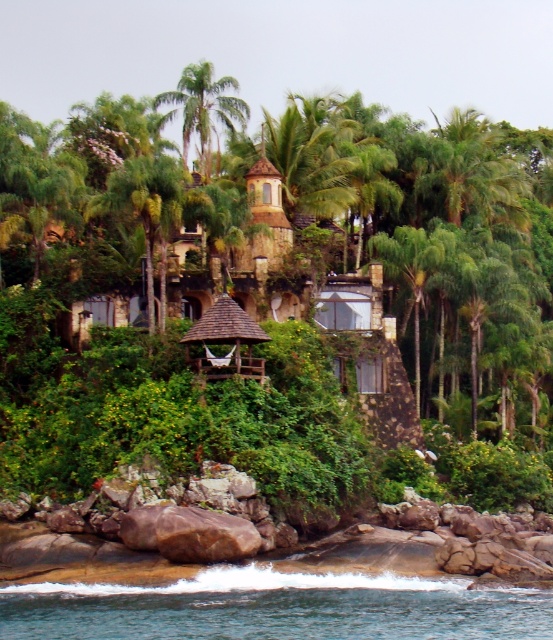
You are standing on the rocky shoreline and want to reach the rustic wood hut at center without getting your feet wet. Which direction should you walk from the clear blue water at lower center?

You should walk to the left from the clear blue water at lower center because it is to the right of the rustic wood hut at center, so moving left will take you towards the hut.

You are standing at the point marked as point [368,353] in the coastal scene. What structure can you see directly in front of you?

At point [368,353] lies rustic wood hut at center, so you can see the rustic wood hut at center directly in front of you.

You are planning to build a small garden between the clear blue water at lower center and the rustic wood hut at center. Considering their sizes, which area would be more suitable for placing a large decorative statue?

The rustic wood hut at center has a larger size compared to the clear blue water at lower center, so placing the large decorative statue near the rustic wood hut at center would be more suitable due to the available space.